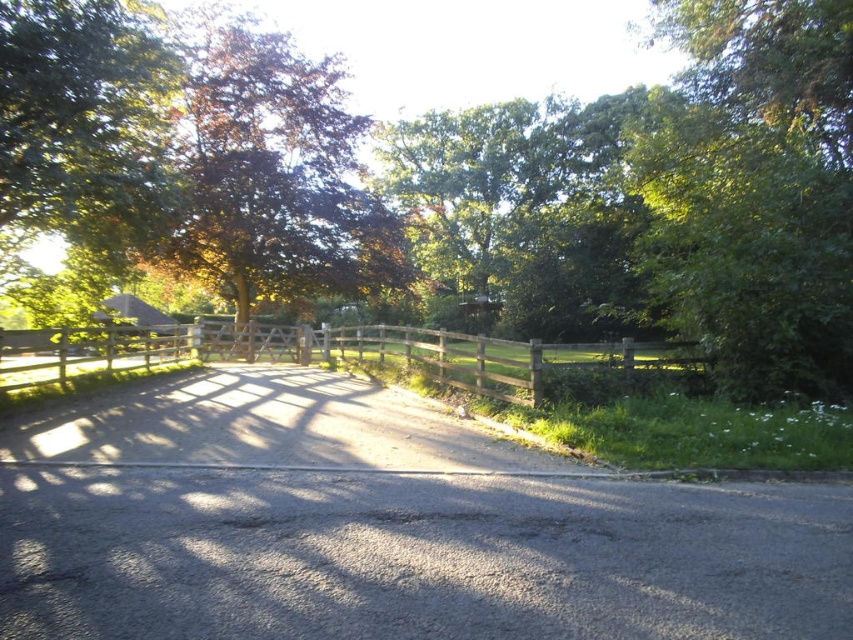
Between green leafy tree at center and brown leafy tree at center, which one has more height?

green leafy tree at center

Who is more forward, (432, 253) or (213, 72)?

Positioned in front is point (213, 72).

Where is `green leafy tree at center`? The width and height of the screenshot is (853, 640). green leafy tree at center is located at coordinates (672, 195).

Who is more forward, (x=502, y=573) or (x=321, y=264)?

Positioned in front is point (x=502, y=573).

Who is taller, gray asphalt driveway at center or brown leafy tree at center?

Standing taller between the two is brown leafy tree at center.

Which is behind, point (142, 397) or point (322, 259)?

Positioned behind is point (322, 259).

Locate an element on the screen. gray asphalt driveway at center is located at coordinates (386, 529).

Can you confirm if gray asphalt driveway at center is positioned above green leafy tree at center?

No, gray asphalt driveway at center is not above green leafy tree at center.

Can you confirm if gray asphalt driveway at center is positioned below green leafy tree at center?

Yes.

Between point (331, 550) and point (178, 252), which one is positioned in front?

Point (331, 550) is more forward.

This screenshot has width=853, height=640. In order to click on gray asphalt driveway at center in this screenshot , I will do `click(386, 529)`.